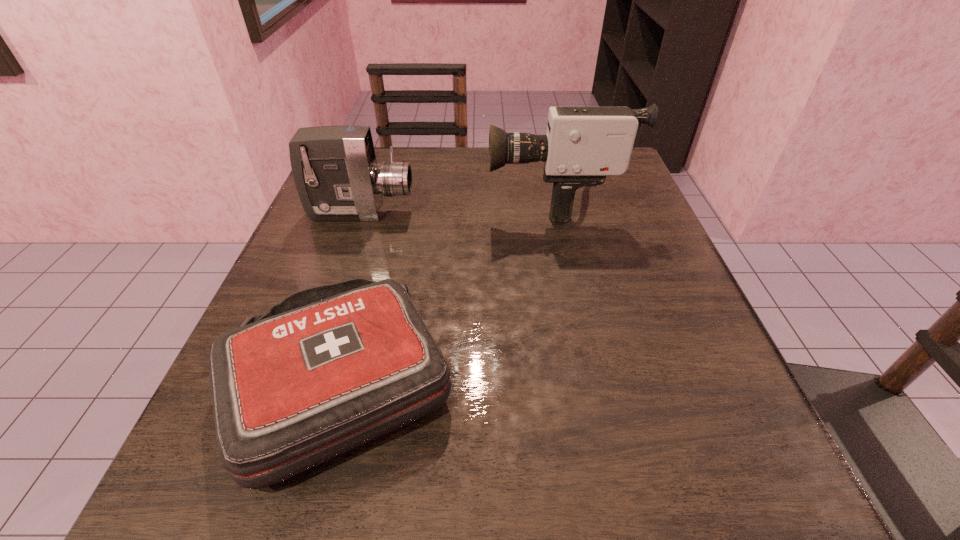
Locate an element on the screen. Image resolution: width=960 pixels, height=540 pixels. free spot located 0.350m on the right of the shortest object is located at coordinates (702, 381).

This screenshot has width=960, height=540. I want to click on object located in the far edge section of the desktop, so click(x=582, y=145).

Find the location of a particular element. object at the near edge is located at coordinates (329, 368).

This screenshot has height=540, width=960. Identify the location of camcorder that is at the left edge. (336, 174).

Identify the location of the first-aid kit at the left edge. The image size is (960, 540). (329, 368).

What are the coordinates of `object at the right edge` in the screenshot? It's located at (582, 145).

You are a GUI agent. You are given a task and a screenshot of the screen. Output one action in this format:
    pyautogui.click(x=<x>, y=<y>)
    Task: Click on the object present at the near left corner
    Image resolution: width=960 pixels, height=540 pixels.
    Given the screenshot: What is the action you would take?
    pyautogui.click(x=329, y=368)

I want to click on object that is at the far right corner, so click(x=582, y=145).

Identify the location of vacant point at the far edge. (441, 184).

In the image, there is a desktop. Where is `vacant region at the near edge`? This screenshot has height=540, width=960. vacant region at the near edge is located at coordinates (491, 494).